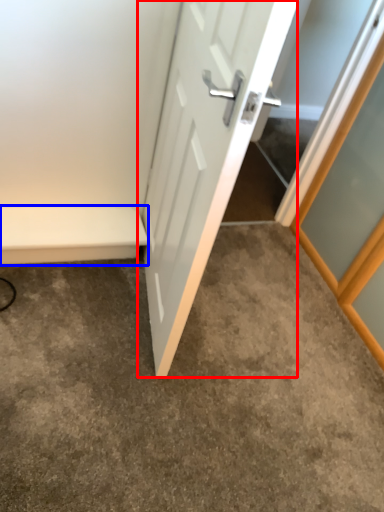
Question: Which object appears closest to the camera in this image, door (highlighted by a red box) or balustrade (highlighted by a blue box)?

Choices:
 (A) door
 (B) balustrade

Answer: (A)